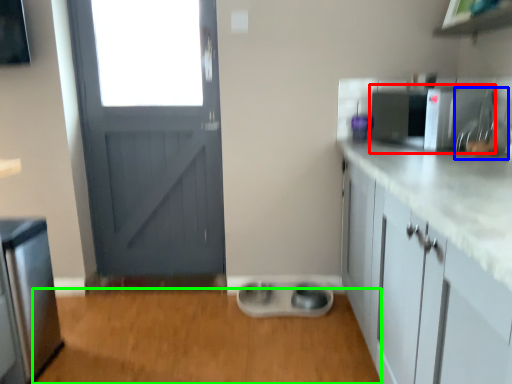
Question: Considering the real-world distances, which object is farthest from appliance (highlighted by a red box)? sink (highlighted by a blue box) or plain (highlighted by a green box)?

Choices:
 (A) sink
 (B) plain

Answer: (B)